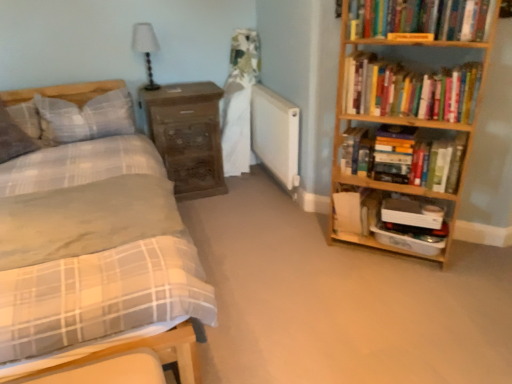
The width and height of the screenshot is (512, 384). I want to click on hardcover book at upper right, acting as the 3th book starting from the bottom, so click(421, 18).

Where is `wooden bookcase at right`? The image size is (512, 384). wooden bookcase at right is located at coordinates (405, 118).

This screenshot has height=384, width=512. What are the coordinates of `wooden cabinet at lower right` in the screenshot? It's located at (390, 215).

What do you see at coordinates (187, 136) in the screenshot? This screenshot has width=512, height=384. I see `wooden carved chest of drawers at center` at bounding box center [187, 136].

This screenshot has width=512, height=384. I want to click on plaid fabric pillow at left, the 1th pillow from the left, so click(13, 138).

From a real-world perspective, is wooden bookcase at right physically located above or below hardcover books at upper right, which is the 2th book in bottom-to-top order?

wooden bookcase at right is below hardcover books at upper right, which is the 2th book in bottom-to-top order.

What's the angular difference between wooden bookcase at right and hardcover books at upper right, which is the 2th book in bottom-to-top order,'s facing directions?

0.805 degrees separate the facing orientations of wooden bookcase at right and hardcover books at upper right, which is the 2th book in bottom-to-top order.

Considering the positions of points (452, 88) and (401, 85), is point (452, 88) farther from camera compared to point (401, 85)?

No, it is in front of (401, 85).

Which object is further away from the camera taking this photo, wooden bookcase at right or hardcover books at upper right, which appears as the 2th book when viewed from the top?

Answer: hardcover books at upper right, which appears as the 2th book when viewed from the top, is behind.

From the image's perspective, which one is positioned lower, hardcover books at right, arranged as the 3th book when viewed from the top, or matte white lampshade at upper left?

hardcover books at right, arranged as the 3th book when viewed from the top, appears lower in the image.

Is hardcover books at right, which ranks as the first book in bottom-to-top order, facing towards matte white lampshade at upper left?

No, hardcover books at right, which ranks as the first book in bottom-to-top order, is not turned towards matte white lampshade at upper left.

Which of these two, hardcover books at right, arranged as the 3th book when viewed from the top, or matte white lampshade at upper left, is bigger?

hardcover books at right, arranged as the 3th book when viewed from the top.

Which object is further away from the camera, hardcover books at right, which ranks as the first book in bottom-to-top order, or matte white lampshade at upper left?

matte white lampshade at upper left is behind.

Would you say plaid fabric pillow at left, which appears as the second pillow when viewed from the right, is to the left or to the right of white matte radiator at center in the picture?

Clearly, plaid fabric pillow at left, which appears as the second pillow when viewed from the right, is on the left of white matte radiator at center in the image.

From the image's perspective, which one is positioned lower, plaid fabric pillow at left, the 1th pillow from the left, or white matte radiator at center?

white matte radiator at center, from the image's perspective.

Is point (1, 144) positioned after point (288, 170)?

That is False.

Which object is closer to the camera taking this photo, plaid fabric pillow at left, the 1th pillow from the left, or white matte radiator at center?

Positioned in front is plaid fabric pillow at left, the 1th pillow from the left.

Considering the sizes of plaid fabric pillow at left, the 1th pillow from the left, and hardcover book at upper right, which is counted as the first paperback book, starting from the front, in the image, is plaid fabric pillow at left, the 1th pillow from the left, wider or thinner than hardcover book at upper right, which is counted as the first paperback book, starting from the front,?

In the image, plaid fabric pillow at left, the 1th pillow from the left, appears to be wider than hardcover book at upper right, which is counted as the first paperback book, starting from the front.

Which of these two, plaid fabric pillow at left, which appears as the second pillow when viewed from the right, or hardcover book at upper right, which is counted as the first paperback book, starting from the front, is smaller?

Smaller between the two is hardcover book at upper right, which is counted as the first paperback book, starting from the front.

Based on the photo, would you say plaid fabric pillow at left, the 1th pillow from the left, is inside or outside hardcover book at upper right, which is the 1th paperback book in top-to-bottom order?

The correct answer is: outside.

From the plaid fabric pillow at left, the 1th pillow from the left, count 2nd paperback book to the right and point to it. Please provide its 2D coordinates.

[(410, 37)]

Between wooden carved chest of drawers at center and plaid fabric pillow at left, the 2th pillow in the left-to-right sequence, which one is positioned in front?

plaid fabric pillow at left, the 2th pillow in the left-to-right sequence, is closer to the camera.

Consider the image. Which object is wider, wooden carved chest of drawers at center or plaid fabric pillow at left, the 2th pillow in the left-to-right sequence?

With larger width is wooden carved chest of drawers at center.

From the image's perspective, is wooden carved chest of drawers at center positioned above or below plaid fabric pillow at left, which ranks as the first pillow in right-to-left order?

wooden carved chest of drawers at center is below plaid fabric pillow at left, which ranks as the first pillow in right-to-left order.

Could you tell me if wooden carved chest of drawers at center is facing plaid fabric pillow at left, the 2th pillow in the left-to-right sequence?

No, wooden carved chest of drawers at center is not oriented towards plaid fabric pillow at left, the 2th pillow in the left-to-right sequence.

From the image's perspective, is white matte radiator at center on top of hardcover book at upper right, acting as the 1th book starting from the top?

Incorrect, from the image's perspective, white matte radiator at center is lower than hardcover book at upper right, acting as the 1th book starting from the top.

Looking at this image, from a real-world perspective, does white matte radiator at center stand above hardcover book at upper right, acting as the 1th book starting from the top?

Incorrect, from a real-world perspective, white matte radiator at center is lower than hardcover book at upper right, acting as the 1th book starting from the top.

Measure the distance between white matte radiator at center and hardcover book at upper right, acting as the 1th book starting from the top.

white matte radiator at center is 1.06 meters away from hardcover book at upper right, acting as the 1th book starting from the top.

Is white matte radiator at center closer to camera compared to hardcover book at upper right, acting as the 1th book starting from the top?

No, it is behind hardcover book at upper right, acting as the 1th book starting from the top.

From the image's perspective, is white matte radiator at center located above or below matte wooden bed at left?

Clearly, from the image's perspective, white matte radiator at center is above matte wooden bed at left.

Considering the positions of points (266, 91) and (93, 244), is point (266, 91) closer to camera compared to point (93, 244)?

No, it is behind (93, 244).

Considering the relative sizes of white matte radiator at center and matte wooden bed at left in the image provided, is white matte radiator at center wider than matte wooden bed at left?

No, white matte radiator at center is not wider than matte wooden bed at left.

Considering the sizes of white matte radiator at center and matte wooden bed at left in the image, is white matte radiator at center bigger or smaller than matte wooden bed at left?

Considering their sizes, white matte radiator at center takes up less space than matte wooden bed at left.

Locate an element on the screen. The width and height of the screenshot is (512, 384). the 2nd book behind the wooden bookcase at right is located at coordinates (409, 89).

From a real-world perspective, count 2nd books downward from the matte white lampshade at upper left and point to it. Please provide its 2D coordinates.

[(404, 157)]

Considering their positions, is matte white lampshade at upper left positioned closer to hardcover books at upper right, which is the 2th book in bottom-to-top order, than hardcover book at center right, the 2th paperback book when ordered from top to bottom?

Among the two, hardcover book at center right, the 2th paperback book when ordered from top to bottom, is located nearer to hardcover books at upper right, which is the 2th book in bottom-to-top order.

When comparing their distances from matte white lampshade at upper left, does wooden cabinet at lower right or hardcover book at upper right, acting as the 1th book starting from the top, seem further?

Among the two, wooden cabinet at lower right is located further to matte white lampshade at upper left.

When comparing their distances from plaid fabric pillow at left, the 1th pillow from the left, does white matte radiator at center or hardcover book at upper right, which appears as the 2th paperback book when viewed from the back, seem closer?

white matte radiator at center is closer to plaid fabric pillow at left, the 1th pillow from the left.

Estimate the real-world distances between objects in this image. Which object is closer to wooden carved chest of drawers at center, wooden cabinet at lower right or plaid fabric pillow at left, which ranks as the first pillow in right-to-left order?

Based on the image, plaid fabric pillow at left, which ranks as the first pillow in right-to-left order, appears to be nearer to wooden carved chest of drawers at center.

Which object lies nearer to the anchor point hardcover book at center right, marked as the 2th paperback book in a front-to-back arrangement, wooden cabinet at lower right or wooden carved chest of drawers at center?

wooden cabinet at lower right.

Based on the photo, considering their positions, is hardcover books at right, which ranks as the first book in bottom-to-top order, positioned further to plaid fabric pillow at left, which appears as the second pillow when viewed from the right, than hardcover books at upper right, which is the 2th book in bottom-to-top order?

hardcover books at upper right, which is the 2th book in bottom-to-top order, lies further to plaid fabric pillow at left, which appears as the second pillow when viewed from the right, than the other object.

Considering their positions, is wooden carved chest of drawers at center positioned further to hardcover books at upper right, which is the 2th book in bottom-to-top order, than plaid fabric pillow at left, the 1th pillow from the left?

plaid fabric pillow at left, the 1th pillow from the left, is positioned further to the anchor hardcover books at upper right, which is the 2th book in bottom-to-top order.

When comparing their distances from hardcover book at upper right, arranged as the second paperback book when ordered from the bottom, does plaid fabric pillow at left, the 1th pillow from the left, or hardcover book at center right, marked as the 1th paperback book in a back-to-front arrangement, seem further?

plaid fabric pillow at left, the 1th pillow from the left, is positioned further to the anchor hardcover book at upper right, arranged as the second paperback book when ordered from the bottom.

The width and height of the screenshot is (512, 384). What are the coordinates of `chest of drawers between matte white lampshade at upper left and wooden bookcase at right in the horizontal direction` in the screenshot? It's located at [187, 136].

This screenshot has height=384, width=512. I want to click on table lamp located between plaid fabric pillow at left, the 2th pillow in the left-to-right sequence, and hardcover books at right, arranged as the 3th book when viewed from the top, in the left-right direction, so click(146, 48).

Image resolution: width=512 pixels, height=384 pixels. What are the coordinates of `chest of drawers between matte wooden bed at left and wooden bookcase at right` in the screenshot? It's located at (187, 136).

This screenshot has height=384, width=512. Identify the location of bookcase located between plaid fabric pillow at left, the 2th pillow in the left-to-right sequence, and hardcover books at right, arranged as the 3th book when viewed from the top, in the left-right direction. (405, 118).